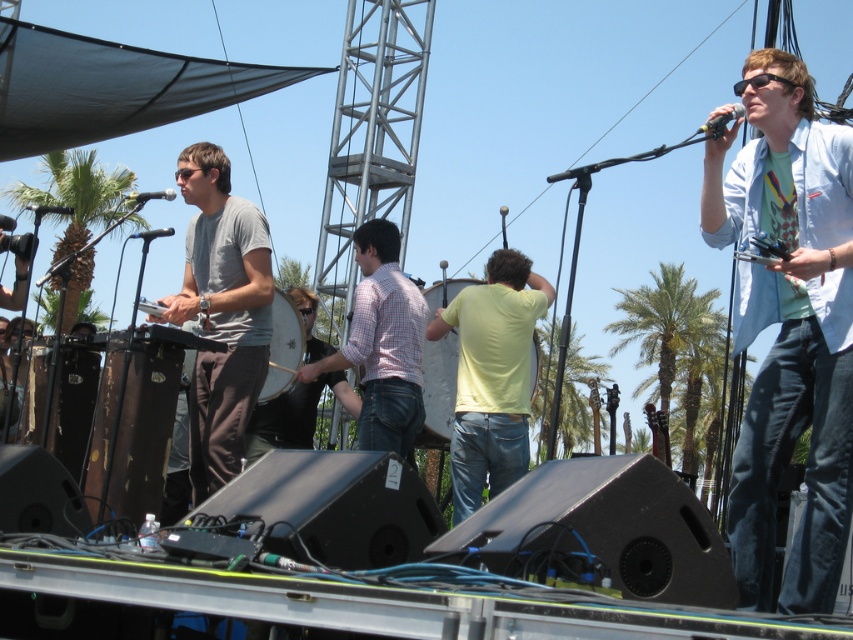
Question: Can you confirm if green leafy palm tree at upper left is positioned to the right of green leafy palm tree at center?

Choices:
 (A) yes
 (B) no

Answer: (B)

Question: Does yellow matte shirt at center have a greater width compared to green leafy palm tree at center?

Choices:
 (A) yes
 (B) no

Answer: (B)

Question: Which point appears farthest from the camera in this image?

Choices:
 (A) (314, 296)
 (B) (540, 275)

Answer: (B)

Question: Among these points, which one is farthest from the camera?

Choices:
 (A) (343, 401)
 (B) (466, 307)

Answer: (A)

Question: Which of the following is the closest to the observer?

Choices:
 (A) (59, 282)
 (B) (364, 388)
 (C) (509, 470)
 (D) (282, 413)

Answer: (B)

Question: Is green leafy palm tree at center to the right of black matte microphone at upper center from the viewer's perspective?

Choices:
 (A) yes
 (B) no

Answer: (A)